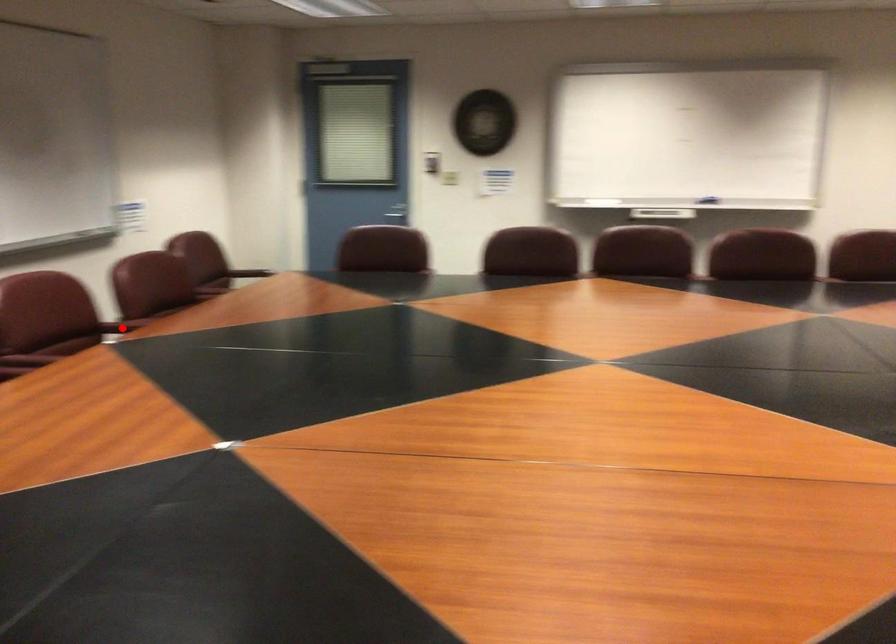
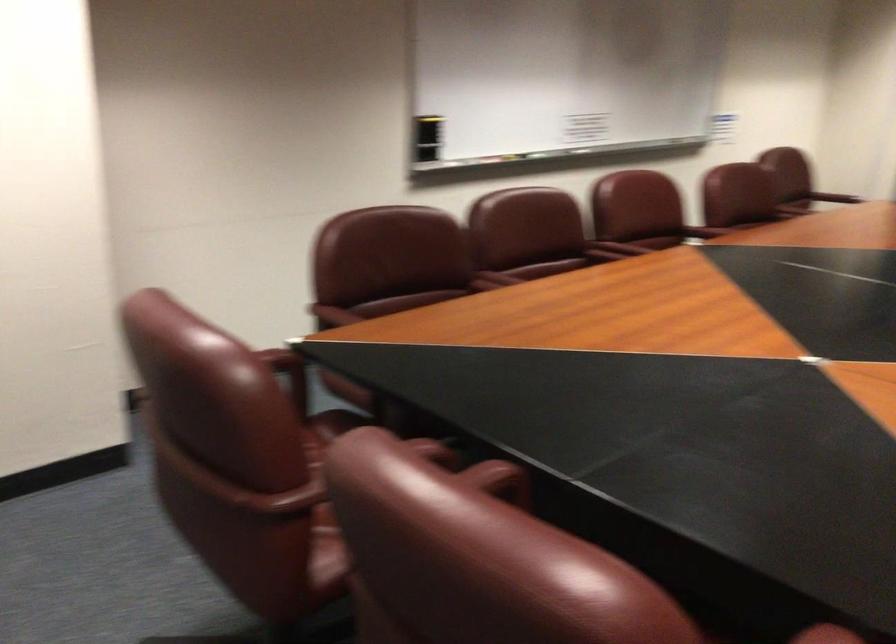
Where in the second image is the point corresponding to the highlighted location from the first image?

(703, 232)